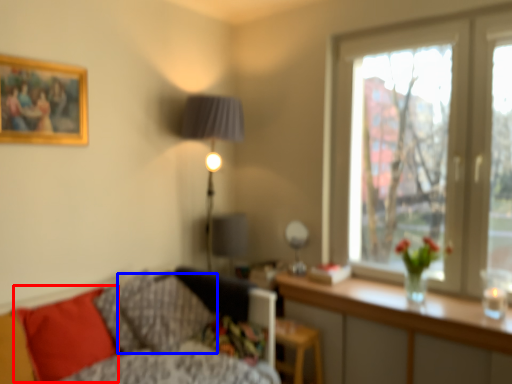
Question: Among these objects, which one is farthest to the camera, pillow (highlighted by a red box) or pillow (highlighted by a blue box)?

Choices:
 (A) pillow
 (B) pillow

Answer: (B)